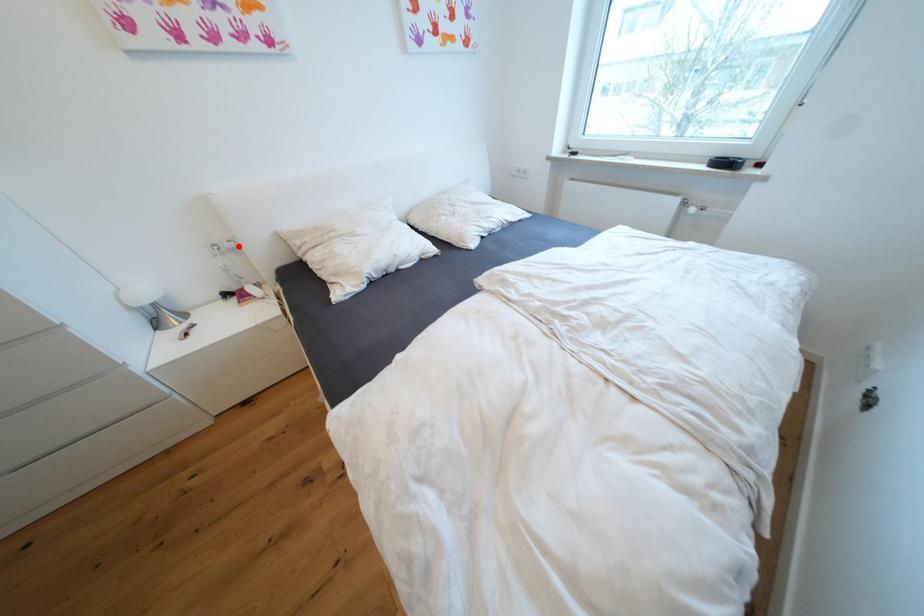
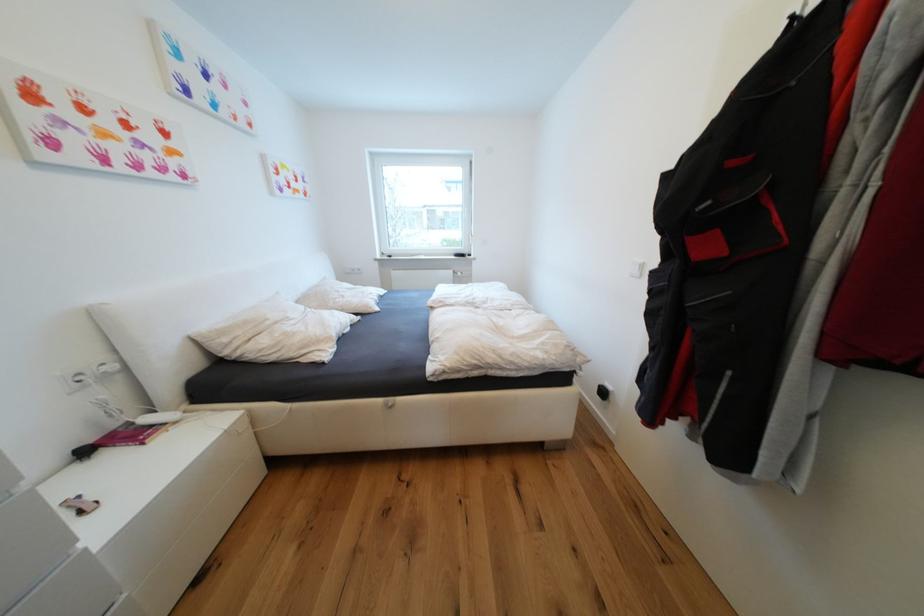
Find the pixel in the second image that matches the highlighted location in the first image.

(119, 369)